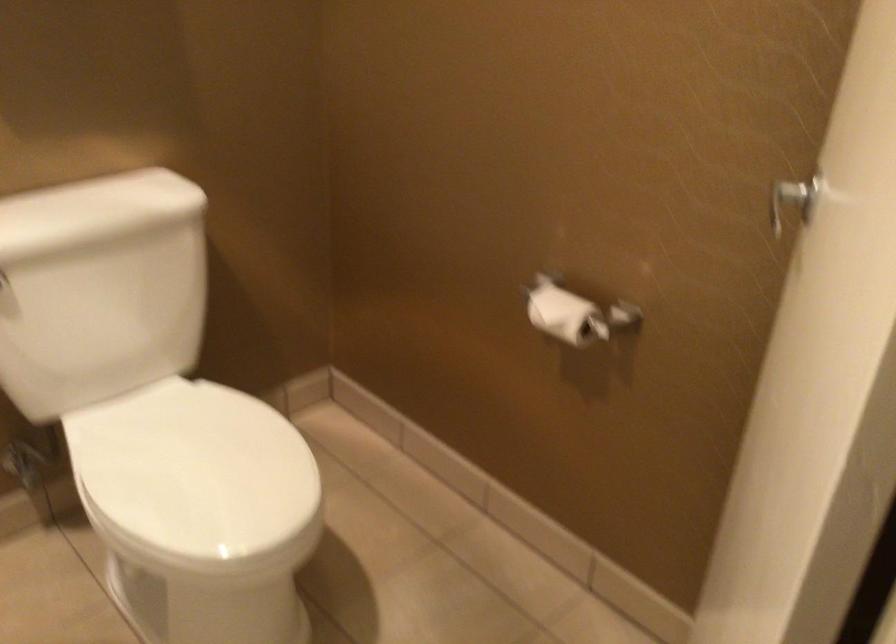
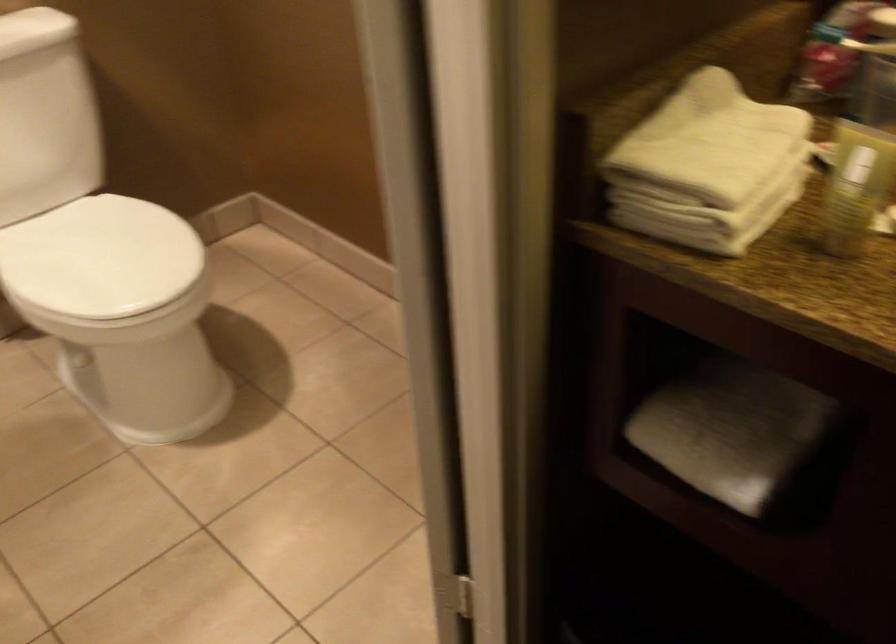
Question: The first image is from the beginning of the video and the second image is from the end. How did the camera likely rotate when shooting the video?

Choices:
 (A) Left
 (B) Right
 (C) Up
 (D) Down

Answer: (D)